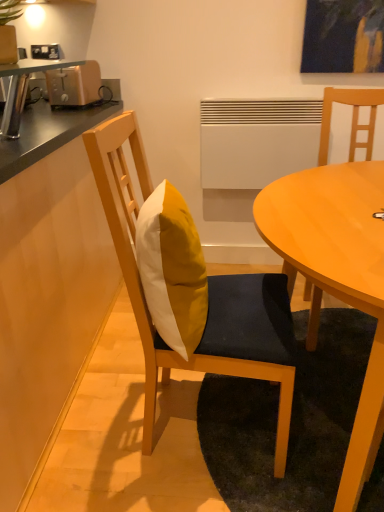
Question: From a real-world perspective, relative to metallic gold toaster at left, is yellow fabric cushion at center, marked as the second chair in a right-to-left arrangement, vertically above or below?

Choices:
 (A) below
 (B) above

Answer: (A)

Question: Is point (215, 345) closer or farther from the camera than point (87, 71)?

Choices:
 (A) closer
 (B) farther

Answer: (A)

Question: Which object is the farthest from the matte wood table at center?

Choices:
 (A) metallic gold toaster at left
 (B) yellow fabric pillow at center
 (C) yellow fabric cushion at center, marked as the second chair in a right-to-left arrangement
 (D) wooden countertop at left
 (E) matte wood chair at center, placed as the first chair when sorted from right to left

Answer: (A)

Question: Which object is the closest to the yellow fabric pillow at center?

Choices:
 (A) yellow fabric cushion at center, which is the first chair from left to right
 (B) matte wood table at center
 (C) metallic gold toaster at left
 (D) matte wood chair at center, which is the second chair from left to right
 (E) wooden countertop at left

Answer: (A)